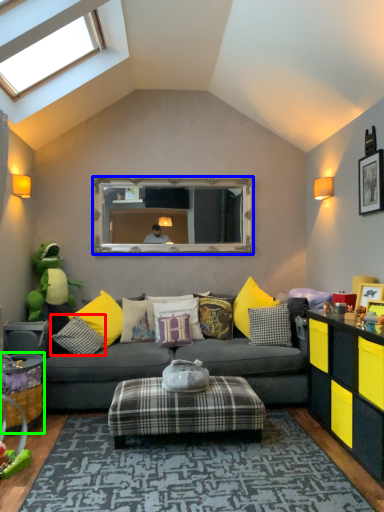
Question: Considering the real-world distances, which object is closest to pillow (highlighted by a red box)? mirror (highlighted by a blue box) or table (highlighted by a green box).

Choices:
 (A) mirror
 (B) table

Answer: (B)